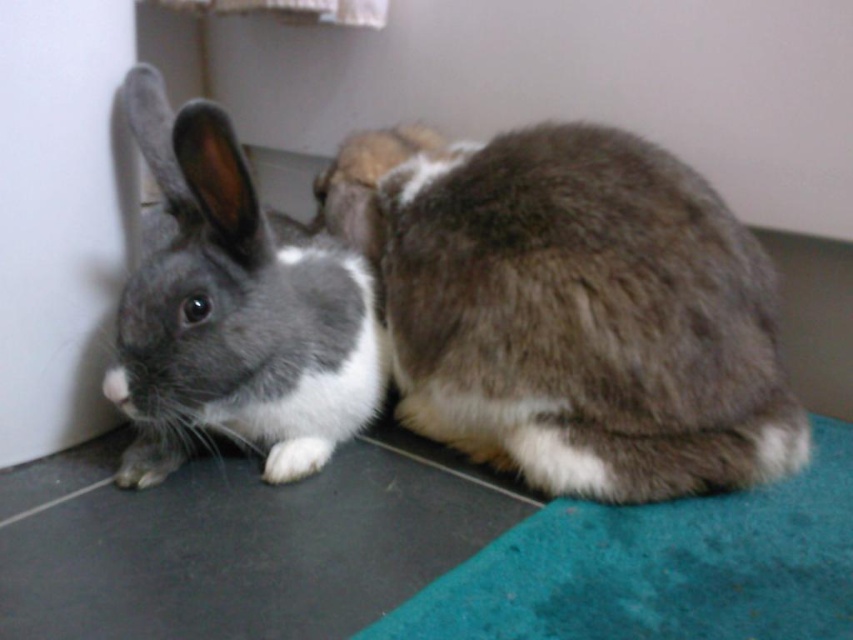
Question: From the image, what is the correct spatial relationship of brown fuzzy rabbit at center in relation to matte gray rabbit at left?

Choices:
 (A) above
 (B) below

Answer: (B)

Question: Among these points, which one is farthest from the camera?

Choices:
 (A) (635, 179)
 (B) (339, 442)

Answer: (B)

Question: Does brown fuzzy rabbit at center lie behind matte gray rabbit at left?

Choices:
 (A) no
 (B) yes

Answer: (B)

Question: Is brown fuzzy rabbit at center to the left of matte gray rabbit at left from the viewer's perspective?

Choices:
 (A) no
 (B) yes

Answer: (A)

Question: Which object appears farthest from the camera in this image?

Choices:
 (A) brown fuzzy rabbit at center
 (B) matte gray rabbit at left

Answer: (A)